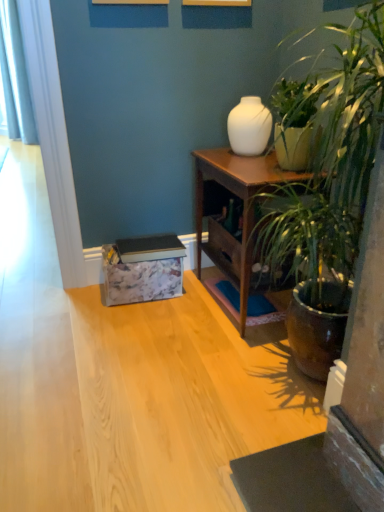
Locate an element on the screen. The width and height of the screenshot is (384, 512). free space in front of wooden nightstand at center-right is located at coordinates (201, 358).